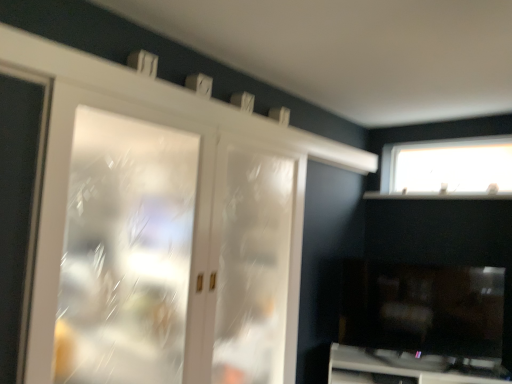
Question: Does white glossy cabinet at lower right appear on the left side of transparent glass window at upper right?

Choices:
 (A) no
 (B) yes

Answer: (B)

Question: From a real-world perspective, is white glossy cabinet at lower right on top of transparent glass window at upper right?

Choices:
 (A) yes
 (B) no

Answer: (B)

Question: Is white glossy cabinet at lower right located outside transparent glass window at upper right?

Choices:
 (A) no
 (B) yes

Answer: (B)

Question: From the image's perspective, is white glossy cabinet at lower right located above transparent glass window at upper right?

Choices:
 (A) no
 (B) yes

Answer: (A)

Question: Can you confirm if white glossy cabinet at lower right is smaller than transparent glass window at upper right?

Choices:
 (A) no
 (B) yes

Answer: (A)

Question: Could you tell me if white glossy cabinet at lower right is facing transparent glass window at upper right?

Choices:
 (A) yes
 (B) no

Answer: (B)

Question: Is white frosted glass screen door at left, the first screen door in the left-to-right sequence, taller than clear glass door at center, positioned as the 1th screen door in back-to-front order?

Choices:
 (A) yes
 (B) no

Answer: (B)

Question: From a real-world perspective, does white frosted glass screen door at left, the second screen door positioned from the back, sit lower than clear glass door at center, the first screen door in the right-to-left sequence?

Choices:
 (A) no
 (B) yes

Answer: (A)

Question: Is white frosted glass screen door at left, the second screen door positioned from the right, to the right of clear glass door at center, placed as the second screen door when sorted from front to back, from the viewer's perspective?

Choices:
 (A) no
 (B) yes

Answer: (A)

Question: From the image's perspective, does white frosted glass screen door at left, the second screen door positioned from the right, appear higher than clear glass door at center, positioned as the 1th screen door in back-to-front order?

Choices:
 (A) no
 (B) yes

Answer: (B)

Question: Is white frosted glass screen door at left, the second screen door positioned from the back, turned away from clear glass door at center, placed as the second screen door when sorted from front to back?

Choices:
 (A) no
 (B) yes

Answer: (A)

Question: Does white frosted glass screen door at left, the 1th screen door from the front, have a lesser height compared to clear glass door at center, the 2th screen door in the left-to-right sequence?

Choices:
 (A) yes
 (B) no

Answer: (A)

Question: Can you confirm if clear glass door at center, the 2th screen door in the left-to-right sequence, is positioned to the left of white frosted glass screen door at left, the 1th screen door from the front?

Choices:
 (A) no
 (B) yes

Answer: (A)